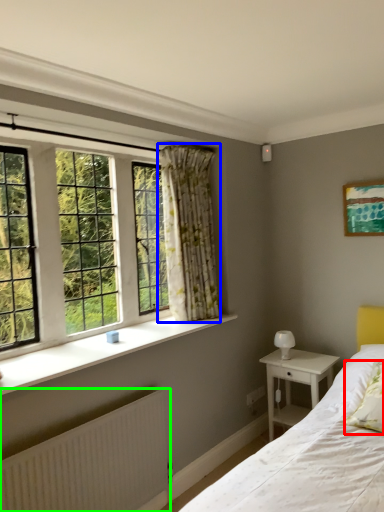
Question: Which is nearer to the pillow (highlighted by a red box)? curtain (highlighted by a blue box) or radiator (highlighted by a green box).

Choices:
 (A) curtain
 (B) radiator

Answer: (B)